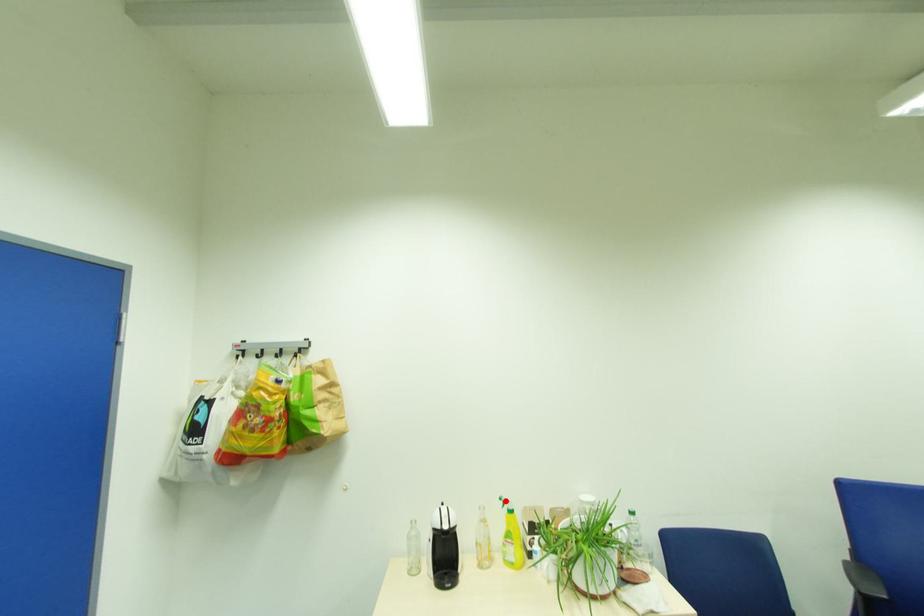
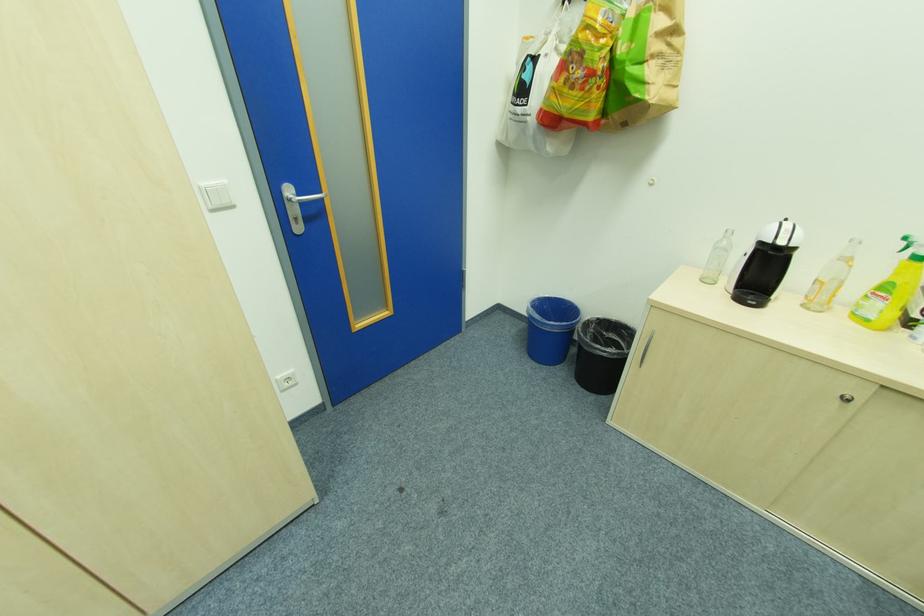
Locate, in the second image, the point that corresponds to the highlighted location in the first image.

(909, 240)